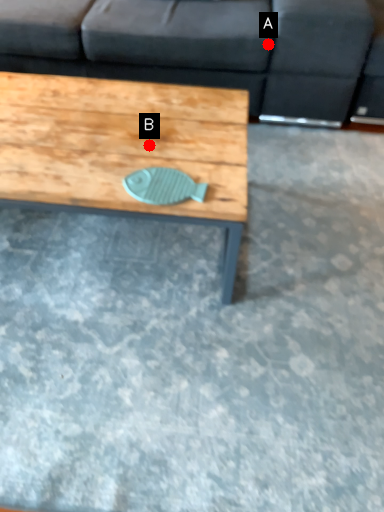
Question: Two points are circled on the image, labeled by A and B beside each circle. Which point is farther from the camera taking this photo?

Choices:
 (A) A is further
 (B) B is further

Answer: (A)